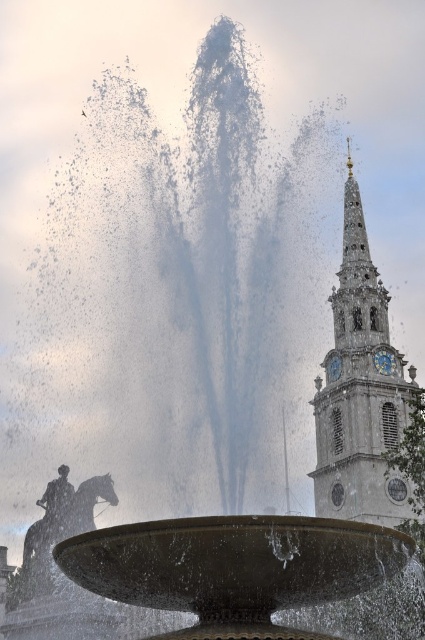
You are a maintenance worker needing to reach both the white stone clock tower at right and the bronze statue at center for cleaning. Given that your ladder can extend up to 25 meters, will you be able to safely reach both locations without moving the ladder?

The white stone clock tower at right and bronze statue at center are 25.51 meters apart. Since the ladder can only extend up to 25 meters, it is 0.51 meters shorter than the distance between the two objects. Therefore, you will not be able to safely reach both locations without moving the ladder.

You are standing in the square facing the fountain. You want to take a photo of the bronze statue at center with the white stone clock tower at right in the background. Is the tower positioned to the right side of the statue in the frame?

Yes, the white stone clock tower at right is positioned on the right side of bronze statue at center, so it will appear to the right of the statue in the photo.

You are standing in the park and see the white stone clock tower at right and the bronze statue at center. Which object is closer to you?

The white stone clock tower at right is closer to you because it is in front of the bronze statue at center.